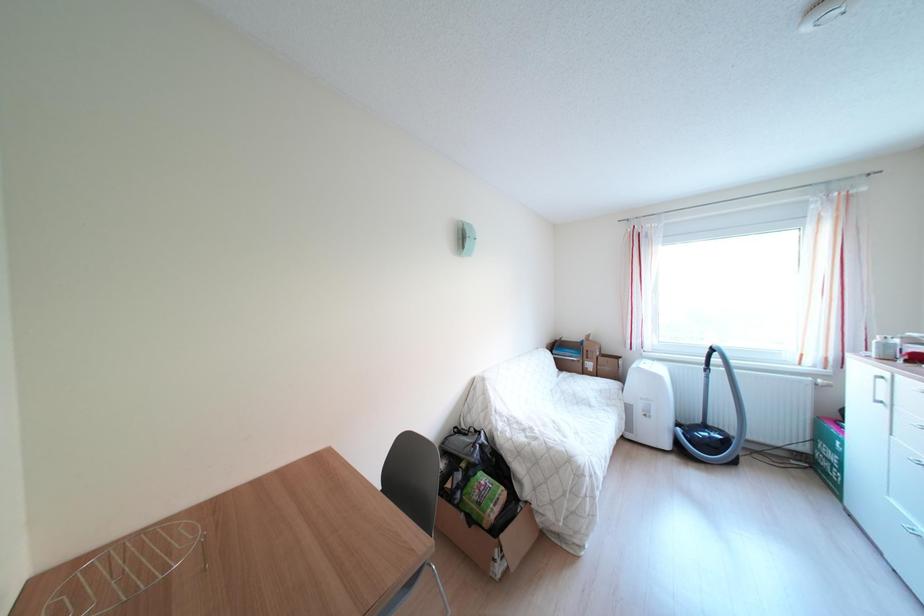
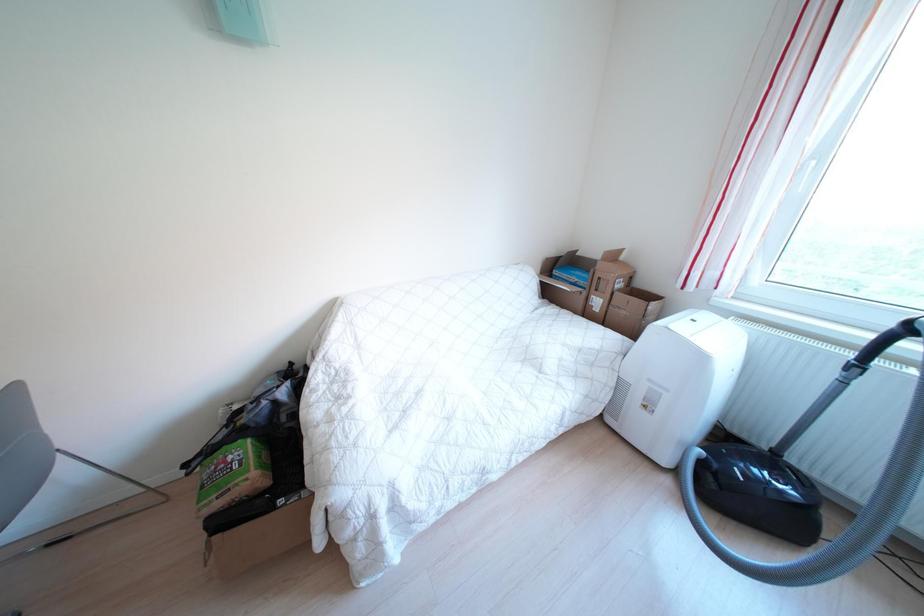
What movement of the cameraman would produce the second image?

The cameraman walked toward right, forward.